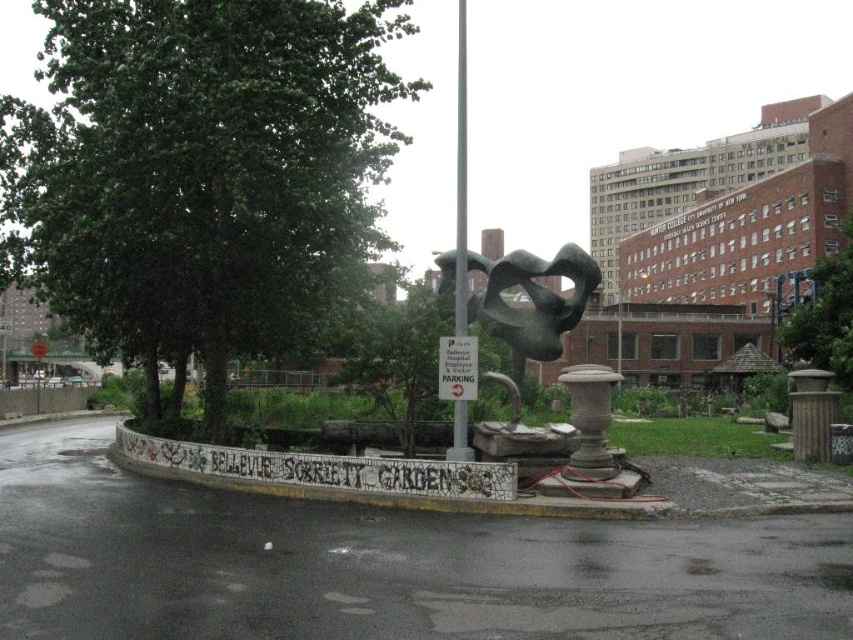
Question: Considering the relative positions of green leafy tree at upper right and metallic pole at center in the image provided, where is green leafy tree at upper right located with respect to metallic pole at center?

Choices:
 (A) right
 (B) left

Answer: (B)

Question: Which object is the closest to the metallic pole at center?

Choices:
 (A) green leafy tree at center
 (B) green leafy tree at upper right
 (C) silver metallic pole at center
 (D) bronze abstract sculpture at center

Answer: (B)

Question: Is silver metallic pole at center smaller than metallic pole at center?

Choices:
 (A) yes
 (B) no

Answer: (B)

Question: Among these objects, which one is farthest from the camera?

Choices:
 (A) bronze abstract sculpture at center
 (B) metallic pole at center

Answer: (B)

Question: Which is farther from the green leafy tree at center?

Choices:
 (A) green leafy tree at upper right
 (B) silver metallic pole at center
 (C) metallic pole at center
 (D) bronze abstract sculpture at center

Answer: (C)

Question: Does bronze abstract sculpture at center have a lesser width compared to metallic pole at center?

Choices:
 (A) no
 (B) yes

Answer: (B)